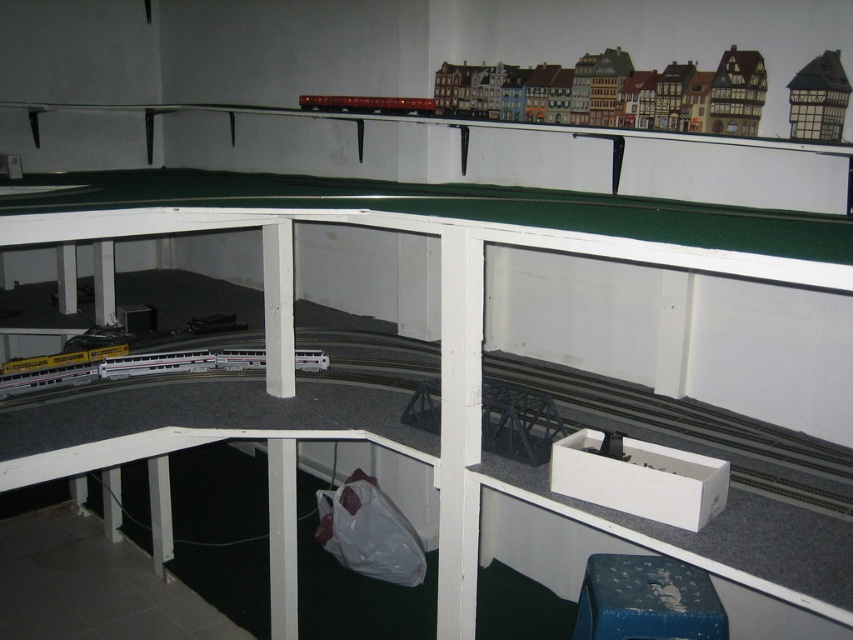
Based on the photo, you are a model train enthusiast who wants to place a new train car between the white plastic train track at lower left and the metallic red train at upper center. Based on their positions, which object should the new train car be closer to?

The new train car should be closer to the metallic red train at upper center because the white plastic train track at lower left is to the right of the metallic red train at upper center, meaning the track is positioned further right compared to the train.

You are a visitor looking at the model train setup. You notice the wooden house at upper right and the metallic red train at upper center. Based on their positions, which object is closer to the ground level of the enclosure?

The wooden house at upper right is located below the metallic red train at upper center, so it is closer to the ground level of the enclosure.